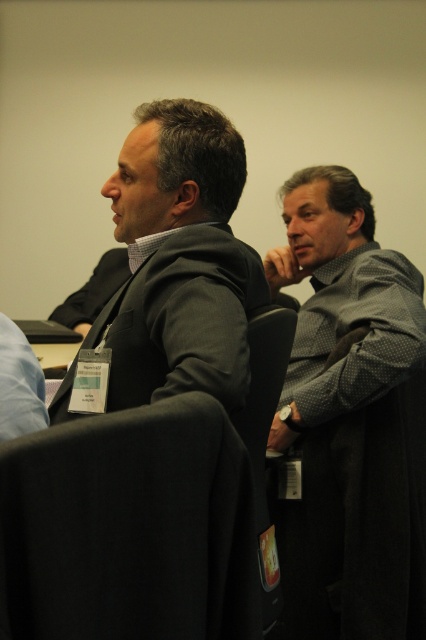
You are standing at the entrance of the conference room and want to sit in the black fabric chair at lower left. According to the coordinates provided, where exactly should you go to find this chair?

The black fabric chair at lower left is located at the coordinates point (129, 528).

You are standing at the point marked as point [227,461] in the conference room. You need to take a photo of the entire table and the two people seated there. If your camera is 79.45 centimeters away from you, will it be able to capture the entire scene without moving closer or farther?

The camera is 79.45 centimeters away from point [227,461], which is the position where you are standing. Since the camera is at this distance, it should be able to capture the entire scene of the table and the two people seated there as long as the camera lens has an appropriate angle of view to encompass the entire area from that distance.

You are standing at the entrance of the conference room. You see a black fabric chair at center. Can you estimate its position relative to the entrance?

The black fabric chair at center is located at point 0.819 on the x axis and 0.836 on the y axis, which is towards the lower right side of the room from the entrance.